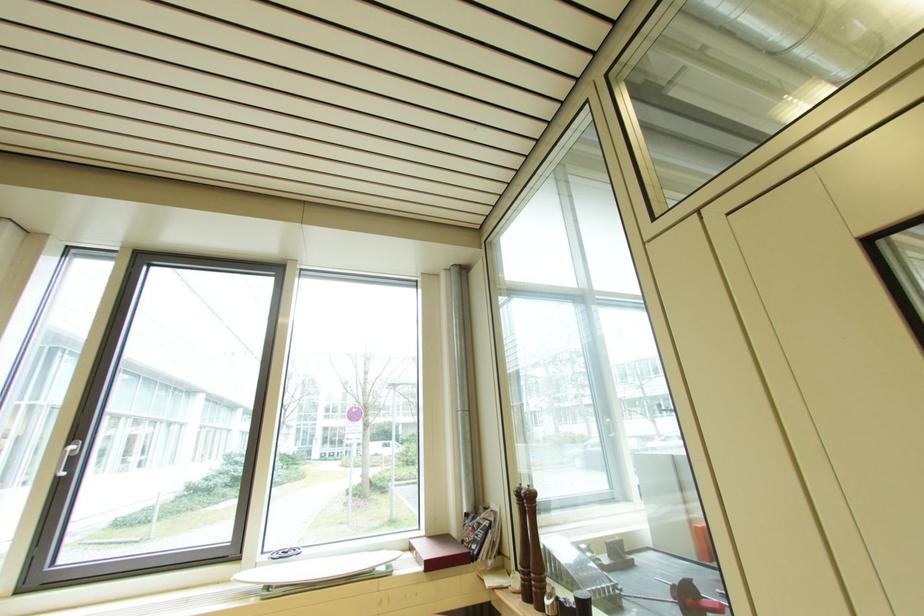
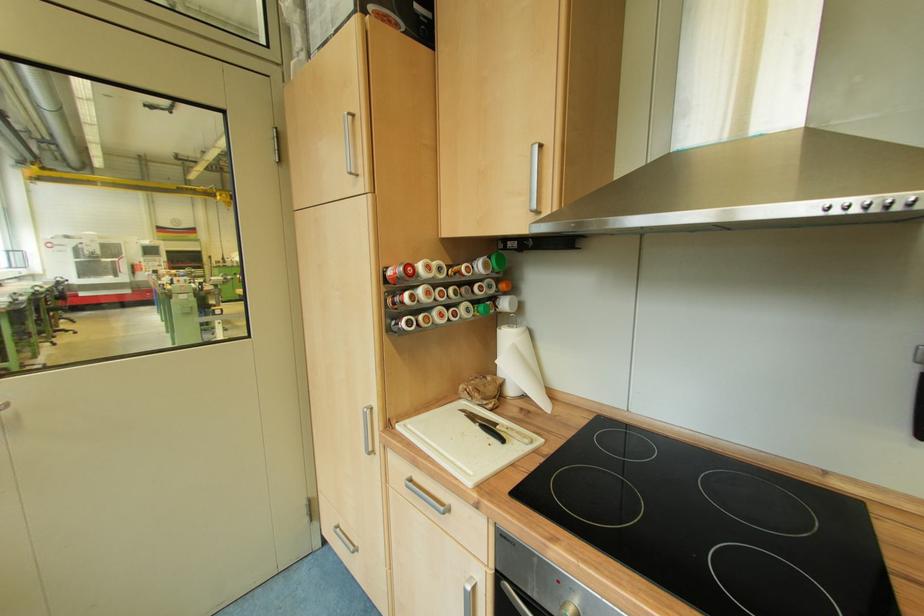
Question: How did the camera likely rotate?

Choices:
 (A) Left
 (B) Right
 (C) Up
 (D) Down

Answer: (B)